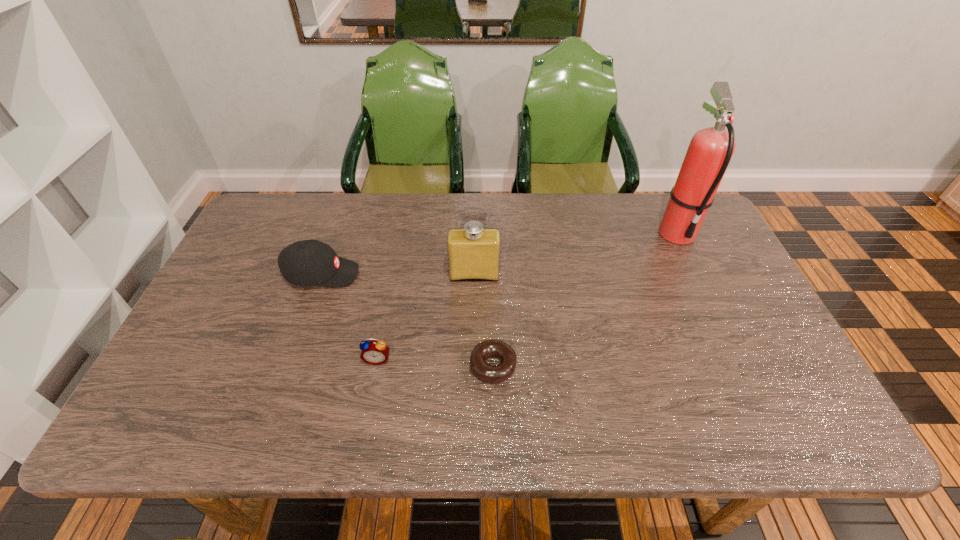
Find the location of a particular element. The height and width of the screenshot is (540, 960). vacant space at the far left corner of the desktop is located at coordinates (289, 201).

The height and width of the screenshot is (540, 960). In order to click on vacant space that's between the perfume and the shortest object in this screenshot , I will do `click(484, 320)`.

Where is `free space between the second shortest object and the doughnut`? The image size is (960, 540). free space between the second shortest object and the doughnut is located at coordinates (435, 362).

Where is `free space between the tallest object and the doughnut`? Image resolution: width=960 pixels, height=540 pixels. free space between the tallest object and the doughnut is located at coordinates (585, 299).

This screenshot has height=540, width=960. I want to click on free spot between the perfume and the alarm clock, so click(x=426, y=317).

Identify the location of free space that is in between the second shortest object and the baseball cap. This screenshot has width=960, height=540. (349, 316).

At what (x,y) coordinates should I click in order to perform the action: click on vacant region between the rightmost object and the alarm clock. Please return your answer as a coordinate pair (x, y). Looking at the image, I should click on (527, 296).

Find the location of a particular element. free space between the alarm clock and the leftmost object is located at coordinates tap(349, 316).

Identify the location of free point between the doughnut and the perfume. This screenshot has width=960, height=540. (484, 320).

Identify the location of free space between the farthest object and the fourth shortest object. Image resolution: width=960 pixels, height=540 pixels. (575, 254).